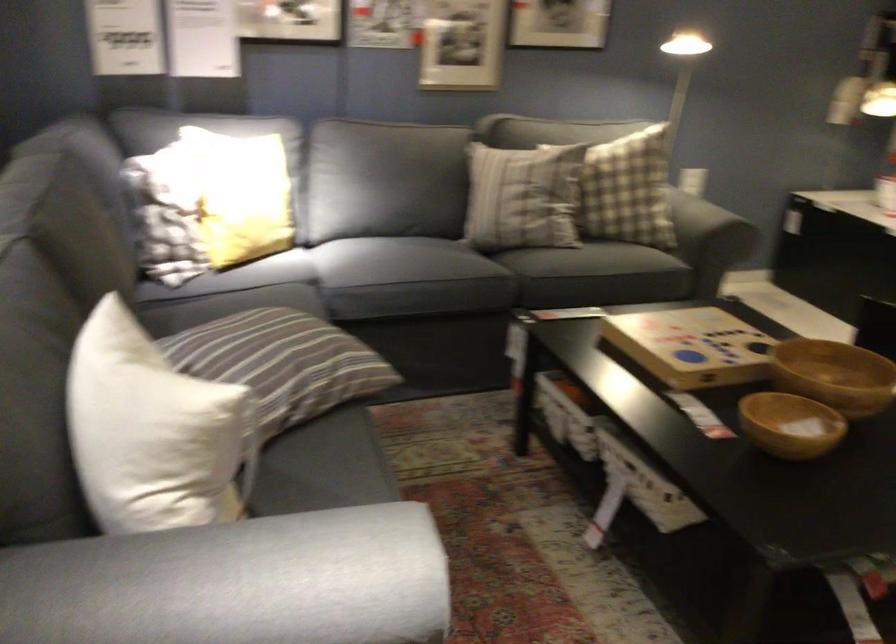
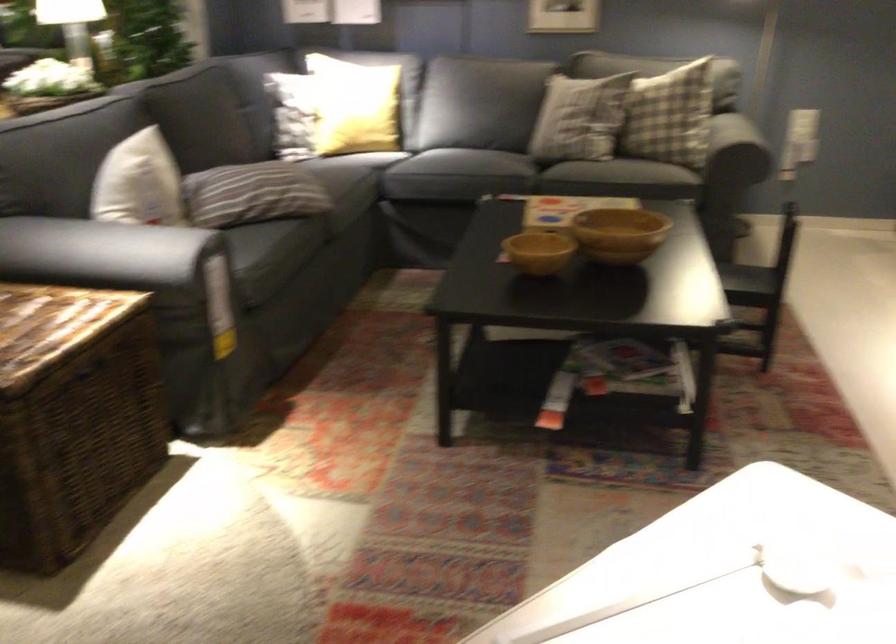
Where in the second image is the point corresponding to (x=306, y=368) from the first image?

(261, 194)